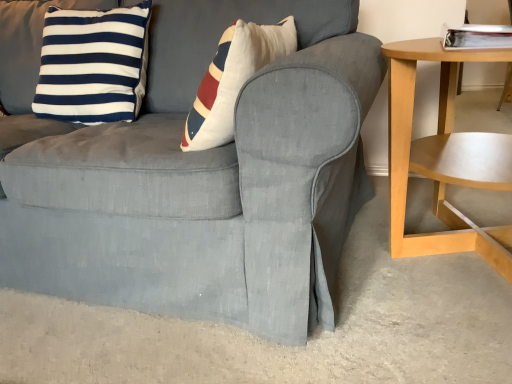
Locate an element on the screen. The image size is (512, 384). vacant region below light wood/woodenobject at right (from a real-world perspective) is located at coordinates (448, 269).